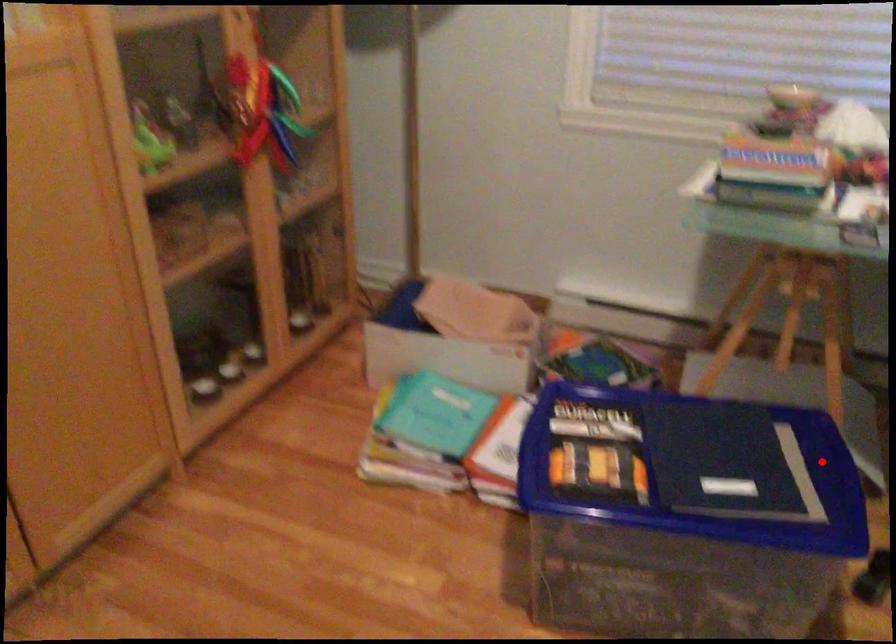
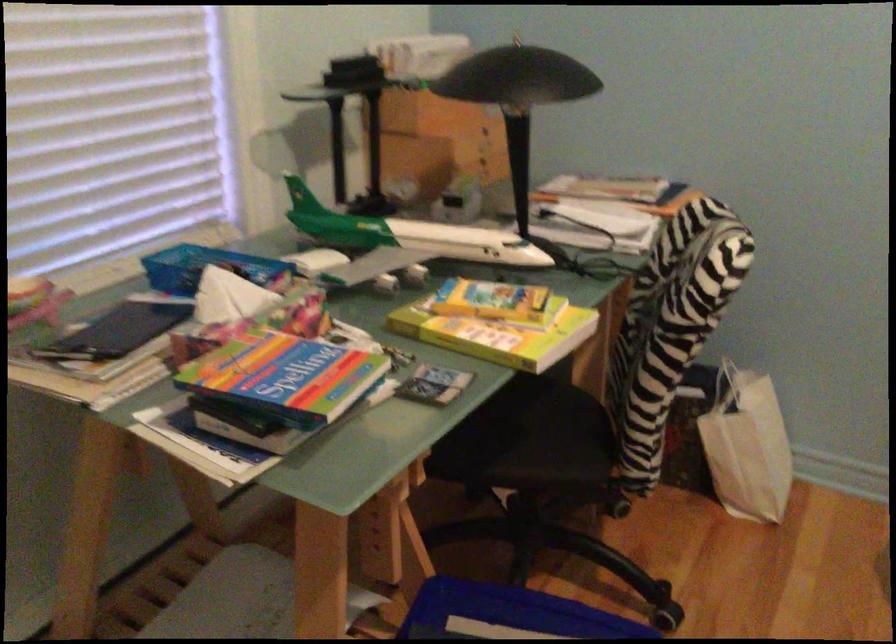
Question: I am providing you with two images of the same scene from different viewpoints. In image1, a red point is highlighted. Considering the same 3D point in image2, which of the following is correct?

Choices:
 (A) It is closer
 (B) It is farther

Answer: (A)